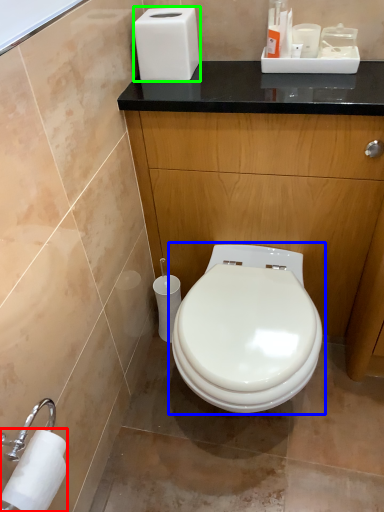
Question: Which object is the farthest from toilet paper (highlighted by a red box)? Choose among these: toilet (highlighted by a blue box) or hand dryer (highlighted by a green box).

Choices:
 (A) toilet
 (B) hand dryer

Answer: (B)